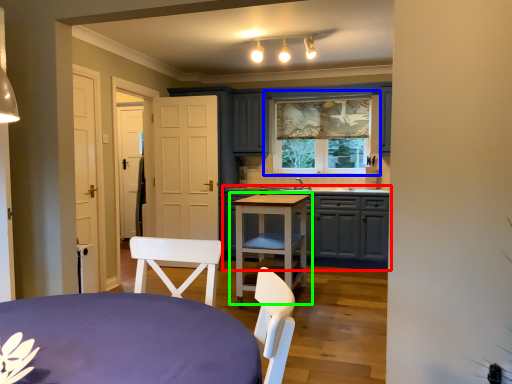
Question: Based on their relative distances, which object is nearer to cabinetry (highlighted by a red box)? Choose from window (highlighted by a blue box) and table (highlighted by a green box).

Choices:
 (A) window
 (B) table

Answer: (B)